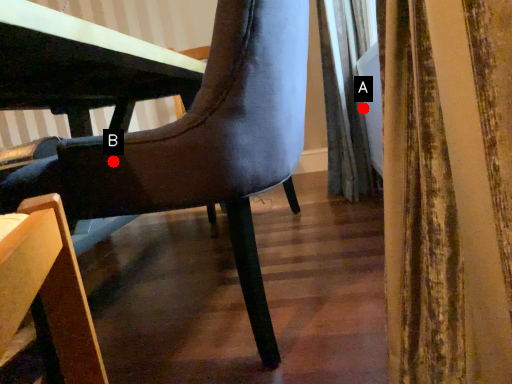
Question: Two points are circled on the image, labeled by A and B beside each circle. Which of the following is the closest to the observer?

Choices:
 (A) A is closer
 (B) B is closer

Answer: (B)